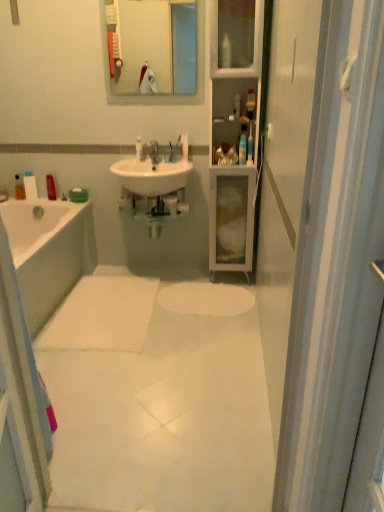
Question: Is white smooth mat at center positioned in front of matte plastic bottle at left, which is the 4th toiletry from right to left?

Choices:
 (A) no
 (B) yes

Answer: (B)

Question: From a real-world perspective, is white smooth mat at center located beneath matte plastic bottle at left, which is the 4th toiletry from right to left?

Choices:
 (A) no
 (B) yes

Answer: (B)

Question: Is white smooth mat at center at the right side of matte plastic bottle at left, positioned as the third toiletry in left-to-right order?

Choices:
 (A) no
 (B) yes

Answer: (B)

Question: From a real-world perspective, is white smooth mat at center located higher than matte plastic bottle at left, the second toiletry in the back-to-front sequence?

Choices:
 (A) yes
 (B) no

Answer: (B)

Question: Is white smooth mat at center facing away from matte plastic bottle at left, positioned as the third toiletry in left-to-right order?

Choices:
 (A) yes
 (B) no

Answer: (B)

Question: Relative to white matte soap bar at left, marked as the 4th toiletry in a front-to-back arrangement, is white smooth mat at center in front or behind?

Choices:
 (A) front
 (B) behind

Answer: (A)

Question: Considering the positions of white smooth mat at center and white matte soap bar at left, the 3th toiletry viewed from the back, in the image, is white smooth mat at center bigger or smaller than white matte soap bar at left, the 3th toiletry viewed from the back,?

Choices:
 (A) big
 (B) small

Answer: (A)

Question: From a real-world perspective, is white smooth mat at center physically located above or below white matte soap bar at left, the 3th toiletry viewed from the back?

Choices:
 (A) below
 (B) above

Answer: (A)

Question: From their relative heights in the image, would you say white smooth mat at center is taller or shorter than white matte soap bar at left, which is the 2th toiletry in left-to-right order?

Choices:
 (A) tall
 (B) short

Answer: (B)

Question: Is white matte soap bar at left, which ranks as the fifth toiletry in right-to-left order, taller or shorter than translucent plastic bottle at upper center, the second toiletry viewed from the right?

Choices:
 (A) short
 (B) tall

Answer: (B)

Question: In terms of size, does white matte soap bar at left, which ranks as the fifth toiletry in right-to-left order, appear bigger or smaller than translucent plastic bottle at upper center, which appears as the 5th toiletry when viewed from the back?

Choices:
 (A) big
 (B) small

Answer: (A)

Question: Relative to translucent plastic bottle at upper center, the second toiletry viewed from the right, is white matte soap bar at left, which ranks as the fifth toiletry in right-to-left order, in front or behind?

Choices:
 (A) behind
 (B) front

Answer: (A)

Question: From a real-world perspective, is white matte soap bar at left, the 3th toiletry viewed from the back, positioned above or below translucent plastic bottle at upper center, positioned as the fifth toiletry in left-to-right order?

Choices:
 (A) below
 (B) above

Answer: (A)

Question: Considering the positions of white matte soap bar at left, which is the 2th toiletry in left-to-right order, and translucent plastic bottle at upper center, positioned as the 1th toiletry in front-to-back order, in the image, is white matte soap bar at left, which is the 2th toiletry in left-to-right order, bigger or smaller than translucent plastic bottle at upper center, positioned as the 1th toiletry in front-to-back order,?

Choices:
 (A) big
 (B) small

Answer: (A)

Question: Is point (31, 186) positioned closer to the camera than point (253, 94)?

Choices:
 (A) farther
 (B) closer

Answer: (A)